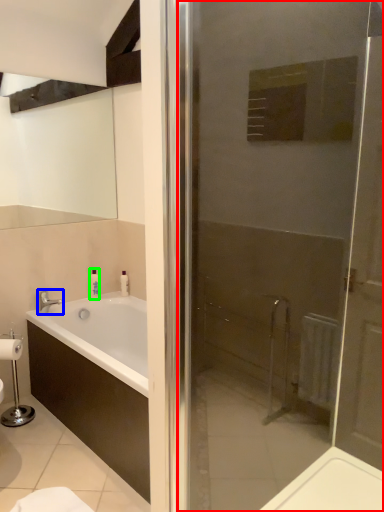
Question: Which object is positioned farthest from door (highlighted by a red box)? Select from tap (highlighted by a blue box) and toiletry (highlighted by a green box).

Choices:
 (A) tap
 (B) toiletry

Answer: (A)